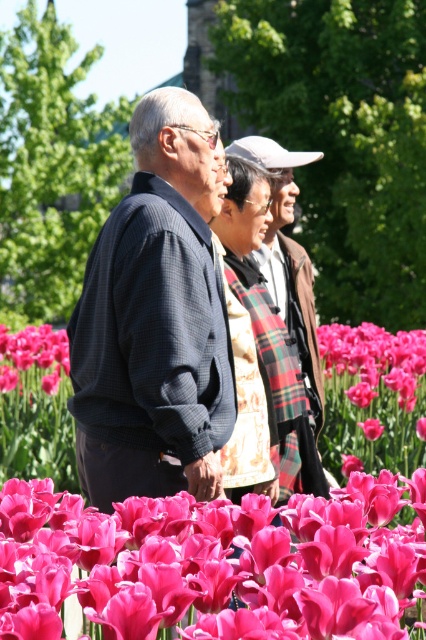
You are a photographer trying to capture a closeup of the dark blue textured jacket at center and the plaid fabric scarf at center. Which object should you zoom in on first to ensure both are in frame?

The dark blue textured jacket at center is wider than the plaid fabric scarf at center, so you should zoom in on the plaid fabric scarf at center first to ensure both fit in the frame.

You are a photographer trying to capture a photo of the pink silky tulips at center and the plaid fabric scarf at center. Which object should you focus on first if you want to include both in the frame without moving the camera?

The pink silky tulips at center are wider than the plaid fabric scarf at center, so you should focus on the pink silky tulips at center first to ensure they fit within the frame.

You are a photographer trying to capture the group of people in the tulip field. You notice the dark blue textured jacket at center and the plaid fabric scarf at center. Which item is covering part of the other?

The dark blue textured jacket at center is positioned over the plaid fabric scarf at center, so the jacket is covering part of the scarf.